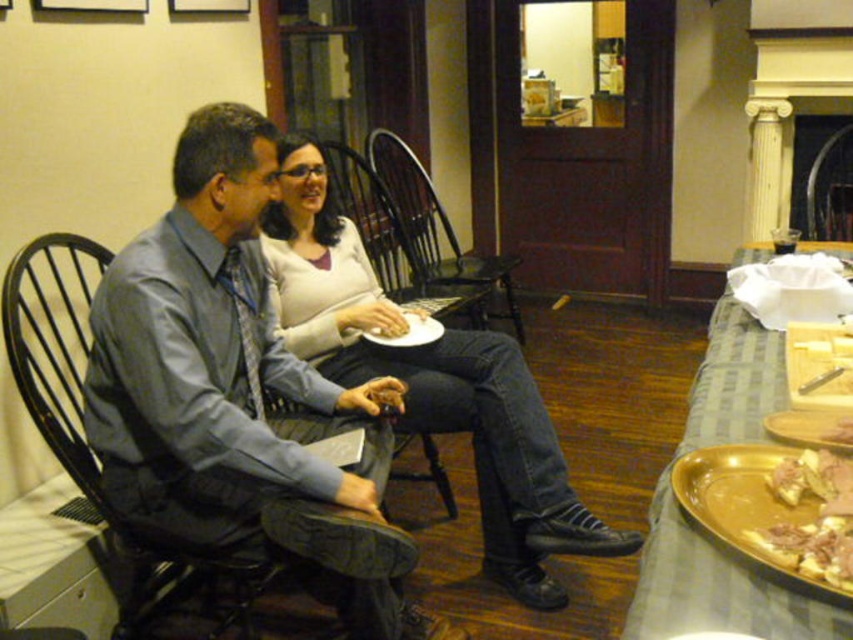
You are a photographer trying to capture the exact position of the gray fabric shirt at center in this scene. According to the coordinates provided, where should you focus your camera lens to ensure the shirt is centered in the frame?

To center the gray fabric shirt at center in the frame, focus the camera lens at the coordinates point specified as point (x=213, y=358).